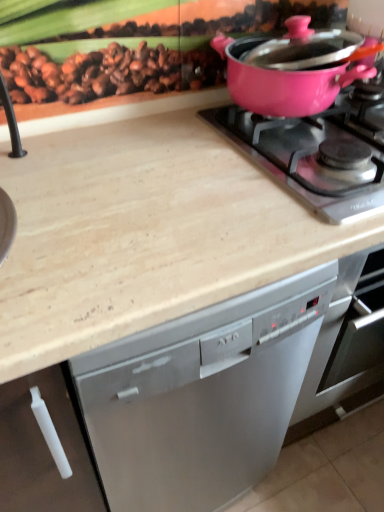
Question: From the image's perspective, is pink glossy pot at upper right located above pink glossy pot at upper right?

Choices:
 (A) no
 (B) yes

Answer: (A)

Question: Is pink glossy pot at upper right oriented towards pink glossy pot at upper right?

Choices:
 (A) no
 (B) yes

Answer: (A)

Question: Considering the relative sizes of pink glossy pot at upper right and pink glossy pot at upper right in the image provided, is pink glossy pot at upper right taller than pink glossy pot at upper right?

Choices:
 (A) yes
 (B) no

Answer: (B)

Question: Is pink glossy pot at upper right in contact with pink glossy pot at upper right?

Choices:
 (A) yes
 (B) no

Answer: (B)

Question: Can you confirm if pink glossy pot at upper right is shorter than pink glossy pot at upper right?

Choices:
 (A) no
 (B) yes

Answer: (B)

Question: From a real-world perspective, is pink glossy pot at upper right over pink glossy pot at upper right?

Choices:
 (A) yes
 (B) no

Answer: (B)

Question: Is beige marble countertop at upper center positioned before pink glossy pot at upper right?

Choices:
 (A) no
 (B) yes

Answer: (B)

Question: From a real-world perspective, is beige marble countertop at upper center on top of pink glossy pot at upper right?

Choices:
 (A) no
 (B) yes

Answer: (A)

Question: Does beige marble countertop at upper center appear on the left side of pink glossy pot at upper right?

Choices:
 (A) yes
 (B) no

Answer: (A)

Question: Are beige marble countertop at upper center and pink glossy pot at upper right beside each other?

Choices:
 (A) no
 (B) yes

Answer: (A)

Question: Is beige marble countertop at upper center outside pink glossy pot at upper right?

Choices:
 (A) no
 (B) yes

Answer: (B)

Question: Considering the relative sizes of beige marble countertop at upper center and pink glossy pot at upper right in the image provided, is beige marble countertop at upper center wider than pink glossy pot at upper right?

Choices:
 (A) no
 (B) yes

Answer: (B)

Question: From a real-world perspective, does pink glossy pot at upper right stand above beige marble countertop at upper center?

Choices:
 (A) no
 (B) yes

Answer: (B)